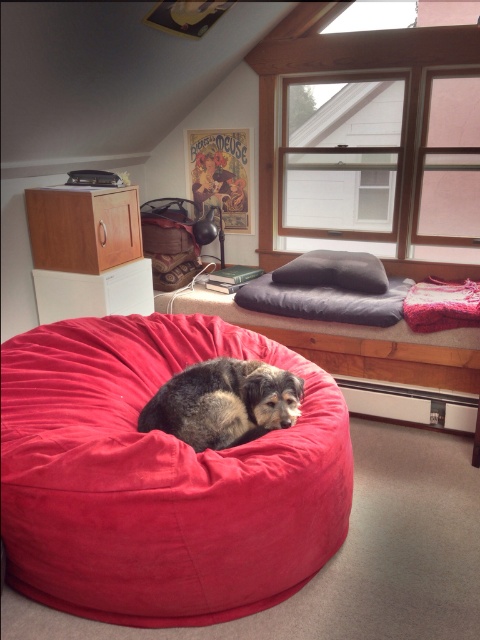
Does fluffy brown dog at center lie in front of velvet dark gray cat bed at upper center?

Yes, it is.

Is fluffy brown dog at center behind velvet dark gray cat bed at upper center?

That is False.

What are the coordinates of `fluffy brown dog at center` in the screenshot? It's located at (224, 403).

From the picture: Which of these two, suede-like red bean bag at center or dark gray plush pillow at upper center, stands taller?

With more height is suede-like red bean bag at center.

Is suede-like red bean bag at center closer to camera compared to dark gray plush pillow at upper center?

Yes, suede-like red bean bag at center is in front of dark gray plush pillow at upper center.

Identify the location of suede-like red bean bag at center. (159, 477).

Who is taller, fluffy brown dog at center or suede bean bag chair at upper center?

suede bean bag chair at upper center

Does fluffy brown dog at center appear under suede bean bag chair at upper center?

Yes.

Is point (168, 397) behind point (144, 205)?

No, (168, 397) is in front of (144, 205).

The image size is (480, 640). Find the location of `fluffy brown dog at center`. fluffy brown dog at center is located at coordinates (224, 403).